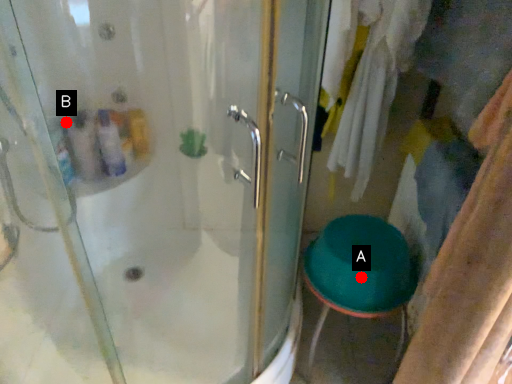
Question: Two points are circled on the image, labeled by A and B beside each circle. Which point is farther from the camera taking this photo?

Choices:
 (A) A is further
 (B) B is further

Answer: (A)